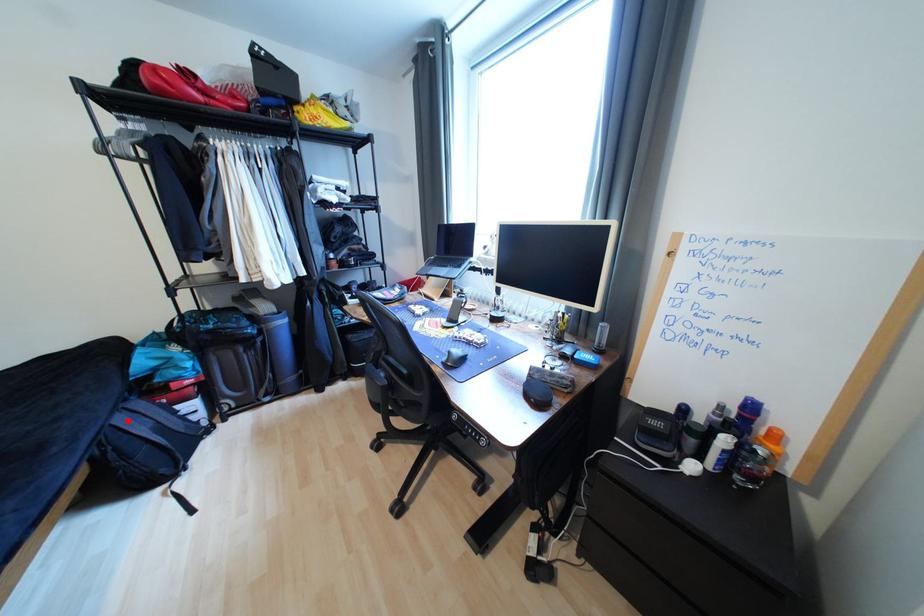
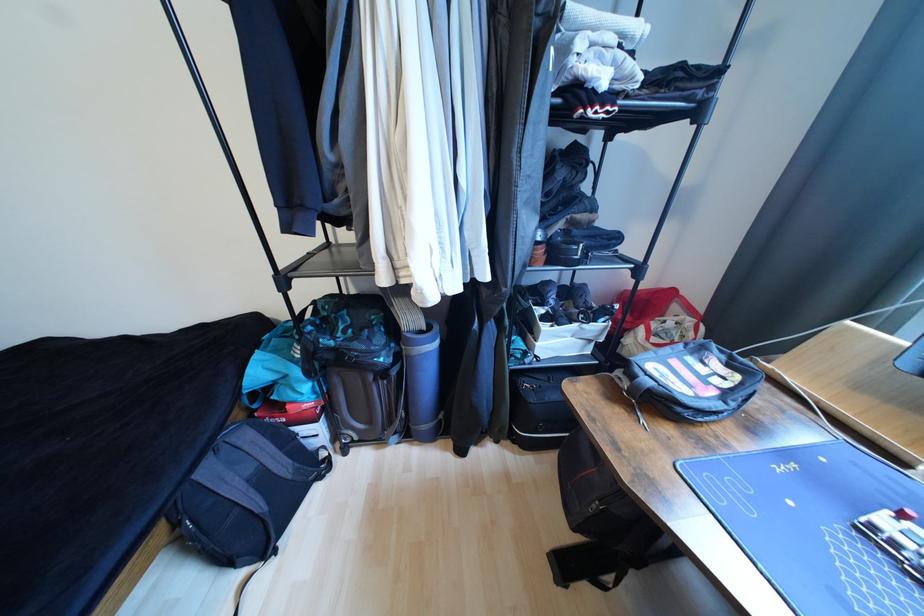
Question: A red point is marked in image1. In image2, is the corresponding 3D point closer to the camera or farther? Reply with the corresponding letter.

Choices:
 (A) The corresponding 3D point is closer.
 (B) The corresponding 3D point is farther.

Answer: (A)